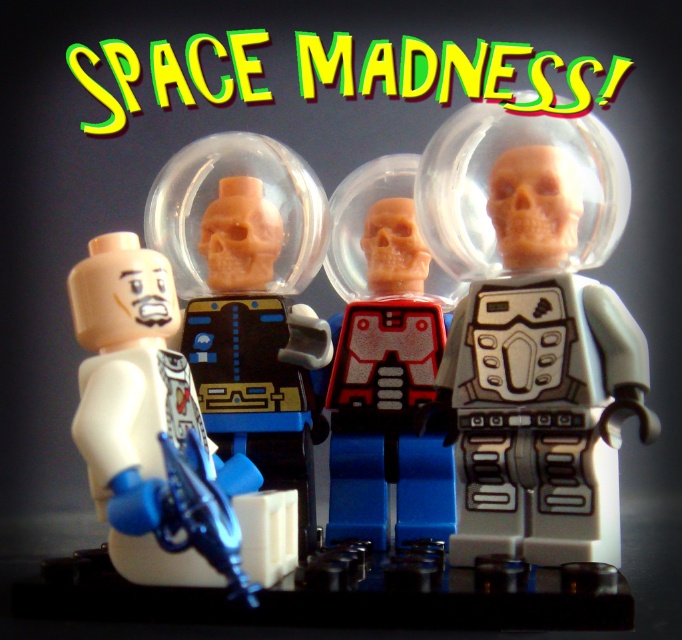
Can you confirm if translucent plastic astronaut at center is wider than white matte astronaut at left?

Yes.

Between point (183, 342) and point (93, 420), which one is positioned in front?

Point (93, 420) is in front.

Locate an element on the screen. The height and width of the screenshot is (640, 682). translucent plastic astronaut at center is located at coordinates (248, 296).

Is light gray plastic astronaut at center smaller than translucent plastic astronaut at center?

Actually, light gray plastic astronaut at center might be larger than translucent plastic astronaut at center.

Can you confirm if light gray plastic astronaut at center is positioned to the right of translucent plastic astronaut at center?

Indeed, light gray plastic astronaut at center is positioned on the right side of translucent plastic astronaut at center.

Is point (604, 332) positioned before point (263, 163)?

Yes, point (604, 332) is in front of point (263, 163).

Identify the location of light gray plastic astronaut at center. The height and width of the screenshot is (640, 682). (533, 330).

In the scene shown: Between matte black astronaut at center and light gray plastic astronaut at center, which one appears on the left side from the viewer's perspective?

matte black astronaut at center

Which is more to the right, matte black astronaut at center or light gray plastic astronaut at center?

light gray plastic astronaut at center is more to the right.

Which is in front, point (578, 285) or point (471, 541)?

Positioned in front is point (471, 541).

Identify the location of matte black astronaut at center. (527, 333).